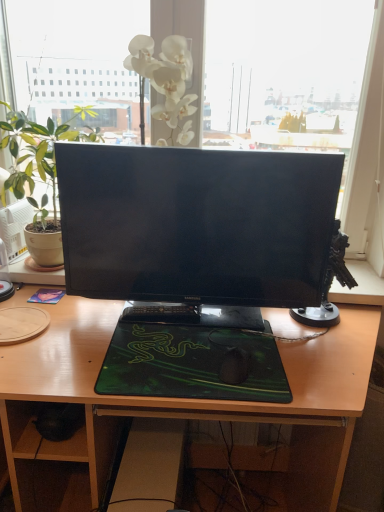
Locate an element on the screen. vacant space to the right of green matte mousepad at center is located at coordinates (323, 355).